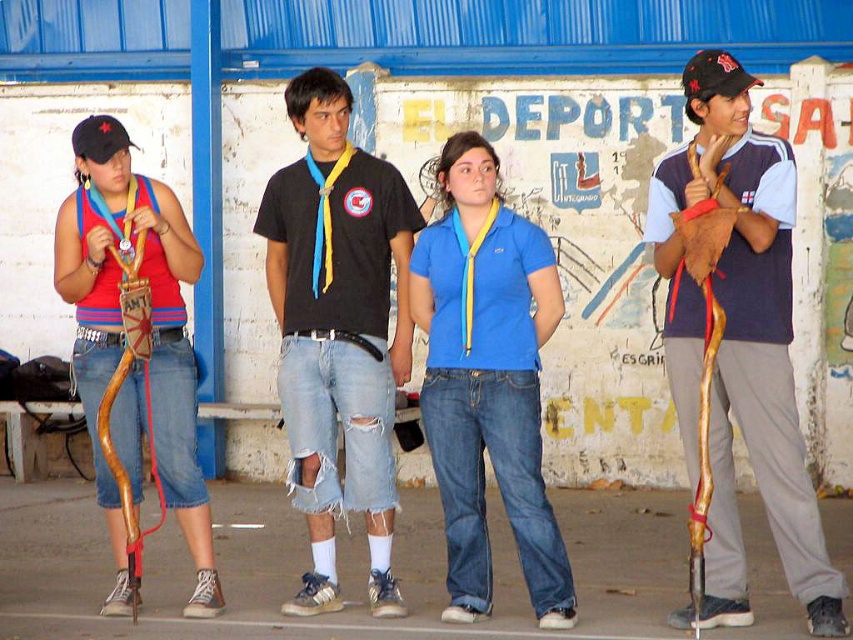
Question: Is the position of wooden cane at right more distant than that of black cotton t-shirt at center?

Choices:
 (A) yes
 (B) no

Answer: (B)

Question: Is wooden cane at right to the left of blue cotton shirt at center from the viewer's perspective?

Choices:
 (A) yes
 (B) no

Answer: (B)

Question: Is the position of blue cotton shirt at center more distant than that of matte brown wooden bow at left?

Choices:
 (A) yes
 (B) no

Answer: (B)

Question: Which object is the farthest from the wooden cane at right?

Choices:
 (A) matte brown wooden bow at left
 (B) blue cotton shirt at center
 (C) black cotton t-shirt at center

Answer: (A)

Question: Which point is farther to the camera?

Choices:
 (A) (155, 371)
 (B) (776, 416)
 (C) (401, 273)

Answer: (C)

Question: Which point is farther to the camera?

Choices:
 (A) wooden cane at right
 (B) blue cotton shirt at center
 (C) black cotton t-shirt at center
 (D) matte brown wooden bow at left

Answer: (D)